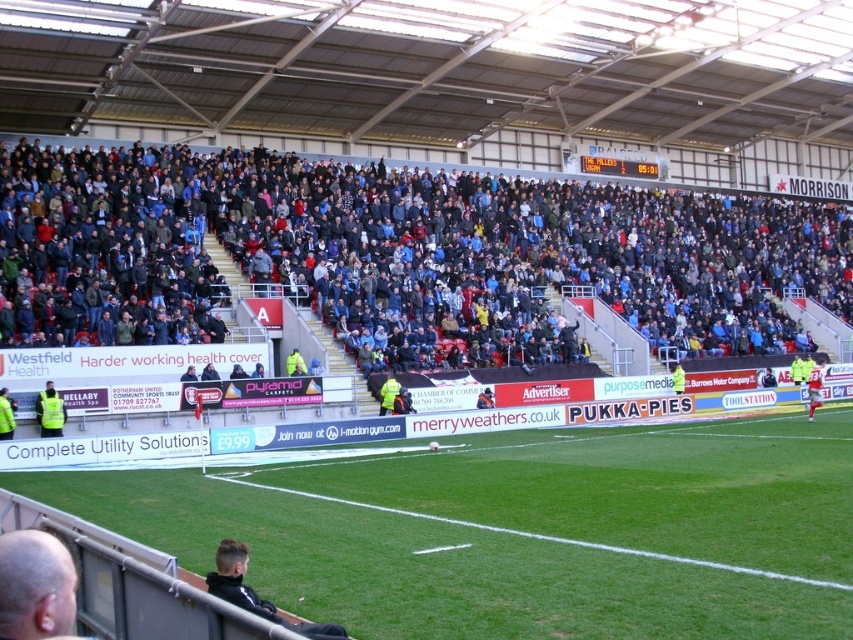
You are a safety inspector at the stadium. You need to ensure that the yellow reflective vest at lower left is within a 10 meter safety zone from the green grass football field at center. Is the current distance compliant with the safety regulations?

The distance between the green grass football field at center and the yellow reflective vest at lower left is 8.05 meters, which is within the 10 meter safety zone requirement. Therefore, the current placement complies with the safety regulations.

You are a photographer positioned at the edge of the field. You want to capture a photo that includes both the yellow reflective vest at lower left and the red jersey at right. Given their sizes, which object should you focus on to ensure both fit in the frame?

The yellow reflective vest at lower left occupies less space than the red jersey at right. To ensure both fit in the frame, focus on the larger object, the red jersey at right, as it requires more space and the smaller vest will naturally fit within the same shot.

You are a photographer standing at the edge of the field. You want to take a photo that includes both the point at coordinates point [711,570] and the point at coordinates point [45,406]. Which point will appear larger in your photo?

Point [711,570] is closer to the viewer than point [45,406], so it will appear larger in the photo.